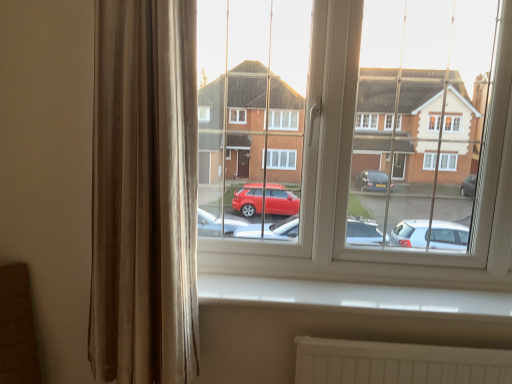
Question: Does velvet beige curtain at left appear on the left side of transparent glass window at center?

Choices:
 (A) yes
 (B) no

Answer: (A)

Question: From a real-world perspective, does velvet beige curtain at left sit lower than transparent glass window at center?

Choices:
 (A) yes
 (B) no

Answer: (A)

Question: From a real-world perspective, is velvet beige curtain at left on transparent glass window at center?

Choices:
 (A) yes
 (B) no

Answer: (B)

Question: Is the position of velvet beige curtain at left more distant than that of transparent glass window at center?

Choices:
 (A) yes
 (B) no

Answer: (B)

Question: Considering the relative sizes of velvet beige curtain at left and transparent glass window at center in the image provided, is velvet beige curtain at left shorter than transparent glass window at center?

Choices:
 (A) yes
 (B) no

Answer: (B)

Question: In terms of height, does velvet beige curtain at left look taller or shorter compared to white plastic window sill at lower center?

Choices:
 (A) short
 (B) tall

Answer: (B)

Question: From the image's perspective, relative to white plastic window sill at lower center, is velvet beige curtain at left above or below?

Choices:
 (A) above
 (B) below

Answer: (A)

Question: Is velvet beige curtain at left bigger or smaller than white plastic window sill at lower center?

Choices:
 (A) big
 (B) small

Answer: (A)

Question: Would you say velvet beige curtain at left is inside or outside white plastic window sill at lower center?

Choices:
 (A) inside
 (B) outside

Answer: (B)

Question: Is point (194, 140) closer or farther from the camera than point (320, 33)?

Choices:
 (A) closer
 (B) farther

Answer: (A)

Question: Looking at their shapes, would you say velvet beige curtain at left is wider or thinner than transparent glass window at center?

Choices:
 (A) thin
 (B) wide

Answer: (B)

Question: From a real-world perspective, is velvet beige curtain at left positioned above or below transparent glass window at center?

Choices:
 (A) above
 (B) below

Answer: (B)

Question: Is velvet beige curtain at left to the left or to the right of transparent glass window at center in the image?

Choices:
 (A) right
 (B) left

Answer: (B)

Question: From a real-world perspective, relative to velvet beige curtain at left, is transparent glass window at center vertically above or below?

Choices:
 (A) above
 (B) below

Answer: (A)

Question: Considering the positions of transparent glass window at center and velvet beige curtain at left in the image, is transparent glass window at center taller or shorter than velvet beige curtain at left?

Choices:
 (A) short
 (B) tall

Answer: (A)